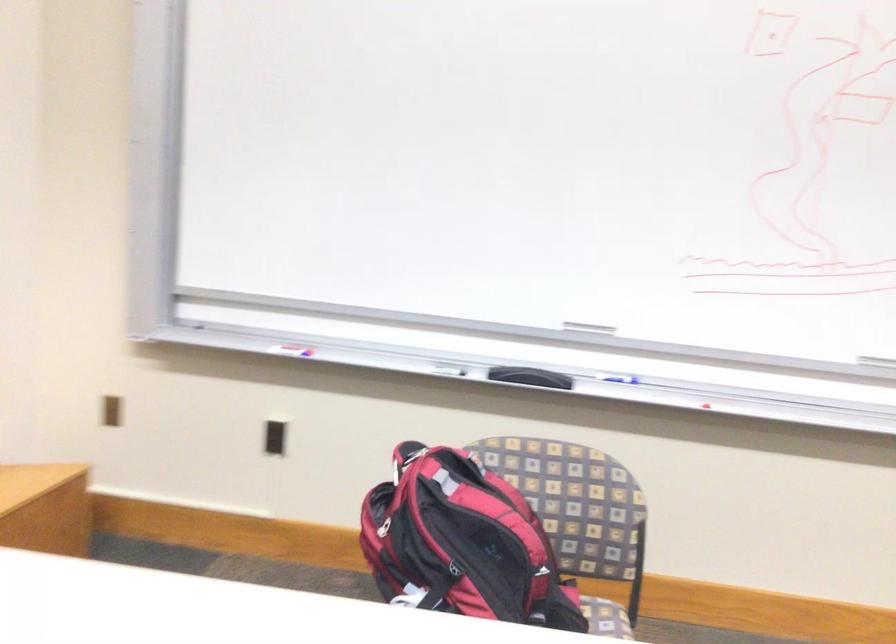
Where would you pull the black zipper pull? Please return your answer as a coordinate pair (x, y).

(383, 527)